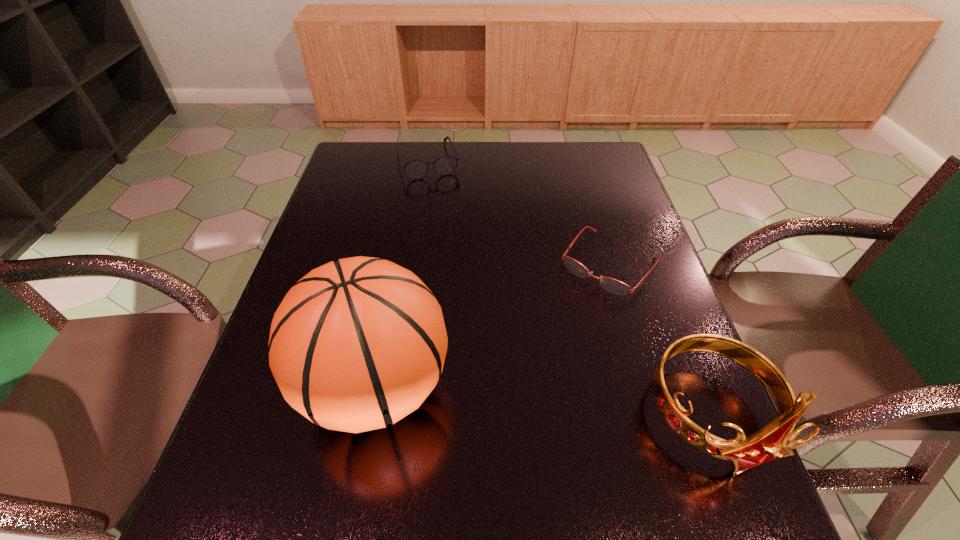
The image size is (960, 540). I want to click on vacant area situated on the front-facing side of the left spectacles, so click(x=441, y=199).

Identify the location of vacant region located 0.160m on the front-facing side of the left spectacles. This screenshot has height=540, width=960. (444, 211).

The image size is (960, 540). I want to click on vacant space located on the front-facing side of the left spectacles, so click(440, 197).

Where is `object that is at the far edge`? This screenshot has height=540, width=960. object that is at the far edge is located at coordinates (417, 169).

This screenshot has width=960, height=540. What are the coordinates of `basketball present at the near edge` in the screenshot? It's located at (356, 344).

Find the location of a particular element. tiara that is at the near edge is located at coordinates (775, 440).

Identify the location of object present at the left edge. (356, 344).

You are a GUI agent. You are given a task and a screenshot of the screen. Output one action in this format:
    pyautogui.click(x=<x>, y=<y>)
    Task: Click on the tiara positioned at the right edge
    
    Given the screenshot: What is the action you would take?
    pyautogui.click(x=775, y=440)

Locate an element on the screen. This screenshot has height=540, width=960. spectacles that is at the right edge is located at coordinates (612, 285).

The image size is (960, 540). I want to click on object that is positioned at the near left corner, so click(356, 344).